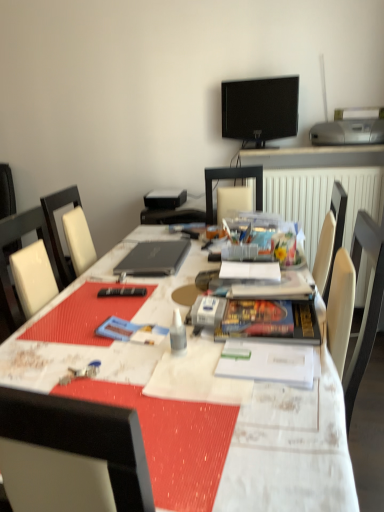
Question: From a real-world perspective, is white plastic glue at center positioned over blue matte paperback book at center, arranged as the second paperback book when viewed from the right, based on gravity?

Choices:
 (A) yes
 (B) no

Answer: (A)

Question: From the image's perspective, is white plastic glue at center over blue matte paperback book at center, which ranks as the 1th paperback book in left-to-right order?

Choices:
 (A) no
 (B) yes

Answer: (B)

Question: Is white plastic glue at center surrounding blue matte paperback book at center, arranged as the second paperback book when viewed from the right?

Choices:
 (A) no
 (B) yes

Answer: (A)

Question: Is white plastic glue at center at the right side of blue matte paperback book at center, which ranks as the 1th paperback book in left-to-right order?

Choices:
 (A) no
 (B) yes

Answer: (B)

Question: Is white plastic glue at center wider than blue matte paperback book at center, which ranks as the 1th paperback book in left-to-right order?

Choices:
 (A) yes
 (B) no

Answer: (B)

Question: Do you think white textured table at center is within white leather chair at left, or outside of it?

Choices:
 (A) outside
 (B) inside

Answer: (A)

Question: From a real-world perspective, relative to white leather chair at left, is white textured table at center vertically above or below?

Choices:
 (A) above
 (B) below

Answer: (B)

Question: Considering the relative positions of white textured table at center and white leather chair at left in the image provided, is white textured table at center to the left or to the right of white leather chair at left?

Choices:
 (A) right
 (B) left

Answer: (A)

Question: From the image's perspective, is white textured table at center positioned above or below white leather chair at left?

Choices:
 (A) above
 (B) below

Answer: (B)

Question: Do you think hardcover book at center, arranged as the second paperback book when viewed from the left, is within white leather chair at left, or outside of it?

Choices:
 (A) outside
 (B) inside

Answer: (A)

Question: In the image, is hardcover book at center, arranged as the second paperback book when viewed from the left, on the left side or the right side of white leather chair at left?

Choices:
 (A) right
 (B) left

Answer: (A)

Question: In terms of width, does hardcover book at center, which ranks as the first paperback book in right-to-left order, look wider or thinner when compared to white leather chair at left?

Choices:
 (A) thin
 (B) wide

Answer: (A)

Question: From the image's perspective, is hardcover book at center, arranged as the second paperback book when viewed from the left, positioned above or below white leather chair at left?

Choices:
 (A) below
 (B) above

Answer: (A)

Question: Is white plastic glue at center in front of or behind blue matte paperback book at center, which ranks as the 1th paperback book in left-to-right order, in the image?

Choices:
 (A) front
 (B) behind

Answer: (A)

Question: Would you say white plastic glue at center is to the left or to the right of blue matte paperback book at center, which ranks as the 1th paperback book in left-to-right order, in the picture?

Choices:
 (A) left
 (B) right

Answer: (B)